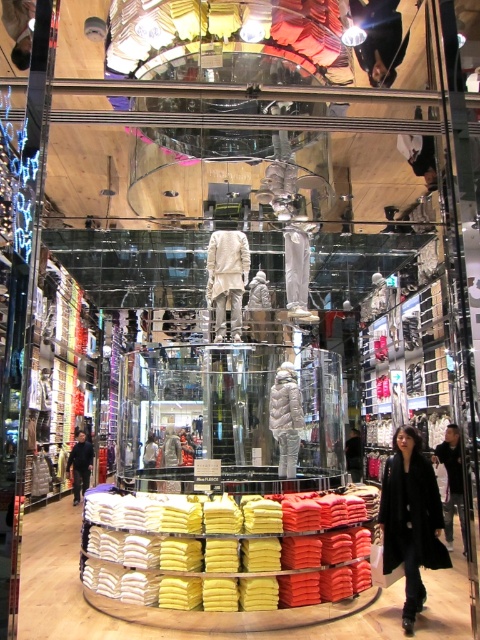
Which is behind, point (287, 470) or point (75, 502)?

The point (75, 502) is behind.

Based on the photo, can you confirm if white down jacket at center is taller than black fabric jacket at lower left?

Indeed, white down jacket at center has a greater height compared to black fabric jacket at lower left.

Between point (279, 410) and point (80, 490), which one is positioned in front?

Positioned in front is point (279, 410).

Where is `white down jacket at center`? Image resolution: width=480 pixels, height=640 pixels. white down jacket at center is located at coordinates (286, 417).

This screenshot has height=640, width=480. Describe the element at coordinates (286, 417) in the screenshot. I see `white down jacket at center` at that location.

Who is positioned more to the right, white down jacket at center or black leather coat at lower right?

black leather coat at lower right

Which is in front, point (294, 420) or point (436, 458)?

Point (294, 420) is more forward.

Find the location of a particular element. white down jacket at center is located at coordinates click(x=286, y=417).

Between point (289, 419) and point (357, 433), which one is positioned behind?

The point (357, 433) is behind.

You are a GUI agent. You are given a task and a screenshot of the screen. Output one action in this format:
    pyautogui.click(x=<x>, y=<y>)
    Task: Click on the white down jacket at center
    This screenshot has width=480, height=640.
    Given the screenshot: What is the action you would take?
    pyautogui.click(x=286, y=417)